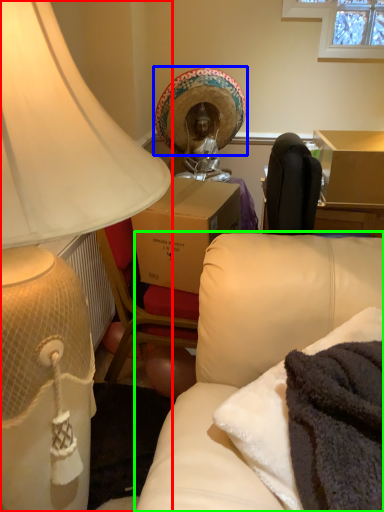
Question: Estimate the real-world distances between objects in this image. Which object is closer to lamp (highlighted by a red box), headdress (highlighted by a blue box) or studio couch (highlighted by a green box)?

Choices:
 (A) headdress
 (B) studio couch

Answer: (B)